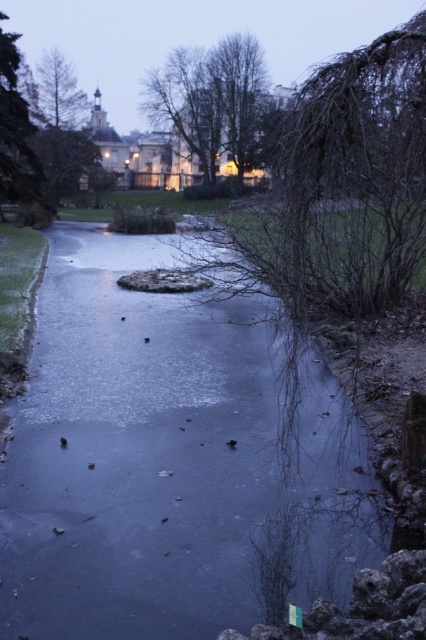
Question: Can you confirm if green leafy tree at center is positioned above green leafy tree at left?

Choices:
 (A) yes
 (B) no

Answer: (A)

Question: Which point is farther to the camera?

Choices:
 (A) bare branches at center
 (B) smooth brown tree at upper left
 (C) green leafy tree at center
 (D) green leafy tree at left

Answer: (C)

Question: Does bare branches at center appear under green leafy tree at center?

Choices:
 (A) no
 (B) yes

Answer: (B)

Question: Is bare branches at center above green leafy tree at left?

Choices:
 (A) no
 (B) yes

Answer: (A)

Question: Based on their relative distances, which object is nearer to the green leafy tree at center?

Choices:
 (A) green leafy tree at left
 (B) bare branches at center
 (C) smooth brown tree at upper left

Answer: (C)

Question: Which is nearer to the bare branches at center?

Choices:
 (A) smooth brown tree at upper left
 (B) green leafy tree at left

Answer: (B)